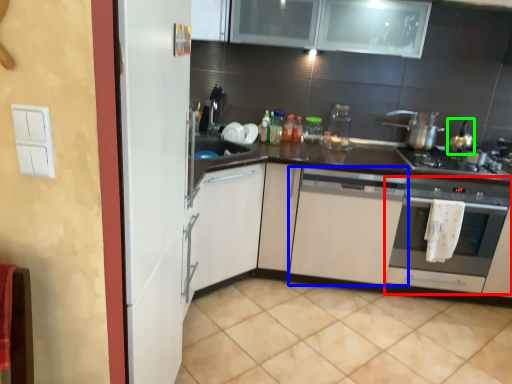
Question: Considering the real-world distances, which object is closest to oven (highlighted by a red box)? cabinetry (highlighted by a blue box) or tea pot (highlighted by a green box).

Choices:
 (A) cabinetry
 (B) tea pot

Answer: (A)